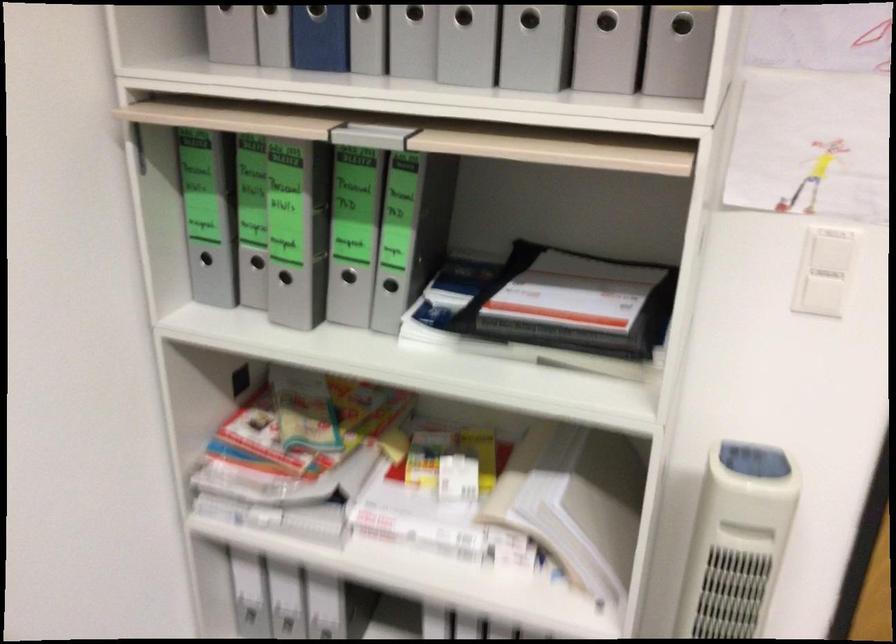
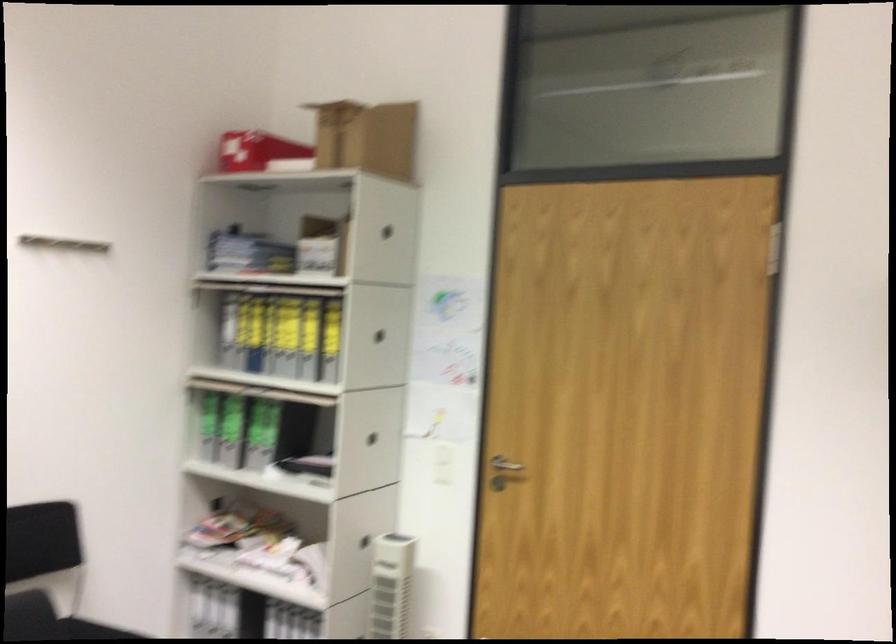
In a continuous first-person perspective shot, in which direction is the camera moving?

The movement direction of the cameraman is right, backward.